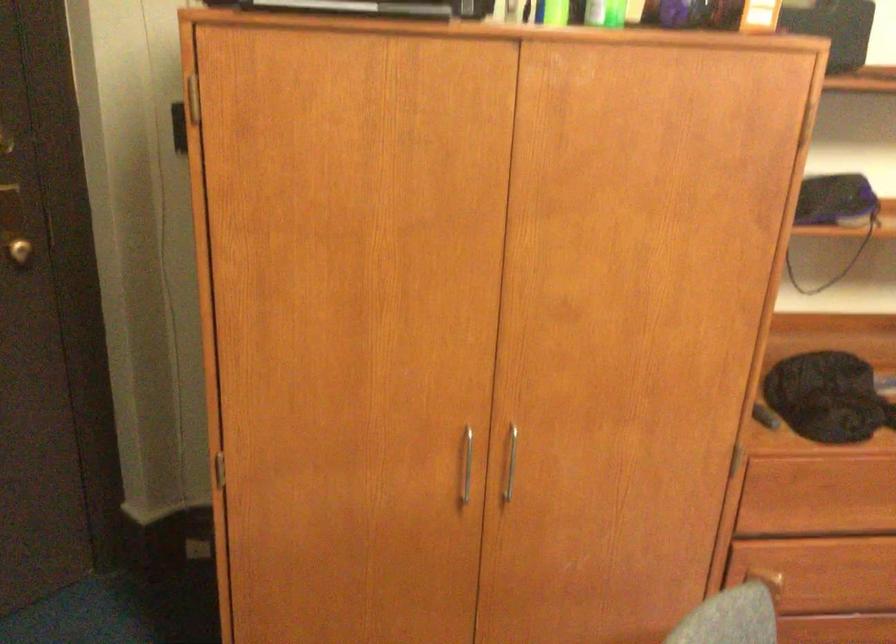
The image size is (896, 644). What do you see at coordinates (825, 495) in the screenshot?
I see `the drawer handle` at bounding box center [825, 495].